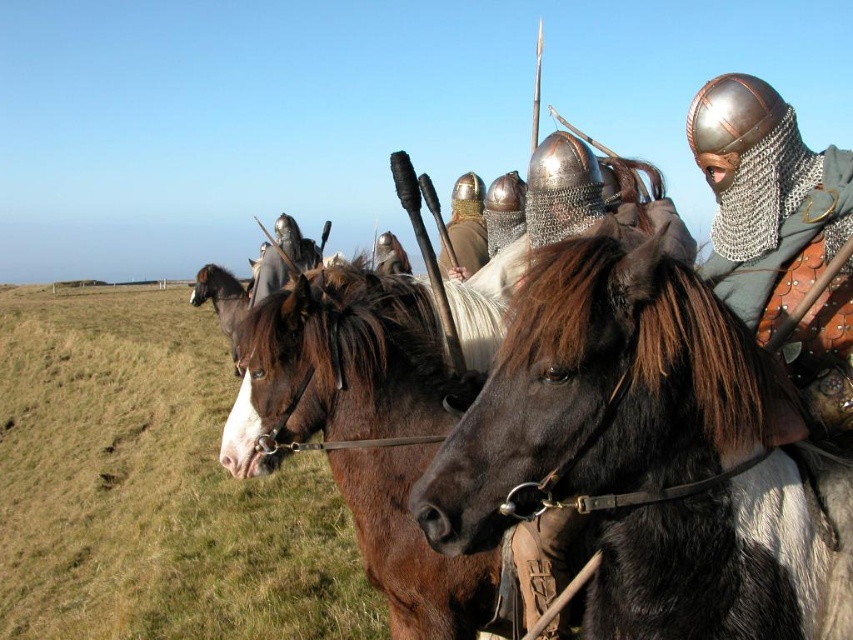
You are a photographer aiming to capture the black leather horse at center in the image. Given that the horse is located at point (650,456), which coordinate corresponds to the horizontal axis?

The horizontal axis is represented by the first coordinate, so the horizontal position of the black leather horse at center is 0.713.

You are a knight preparing to ride your horse across the field. You notice the green grass at lower left and the brown glossy horse at left. Which area would allow your horse to move more freely without getting stuck?

The green grass at lower left has a larger width than the brown glossy horse at left, so the horse can move more freely there.

You are a photographer at a medieval event. You want to capture a photo where the green grass at lower left and the brown glossy horse at left are both visible. Based on their positions, which object should appear lower in the photo?

The green grass at lower left appears lower in the photo because it is positioned below the brown glossy horse at left.